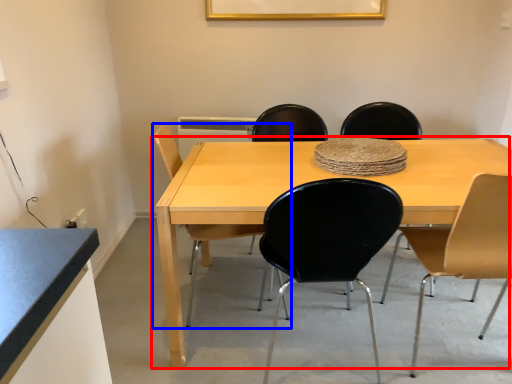
Question: Which object is further to the camera taking this photo, table (highlighted by a red box) or chair (highlighted by a blue box)?

Choices:
 (A) table
 (B) chair

Answer: (B)